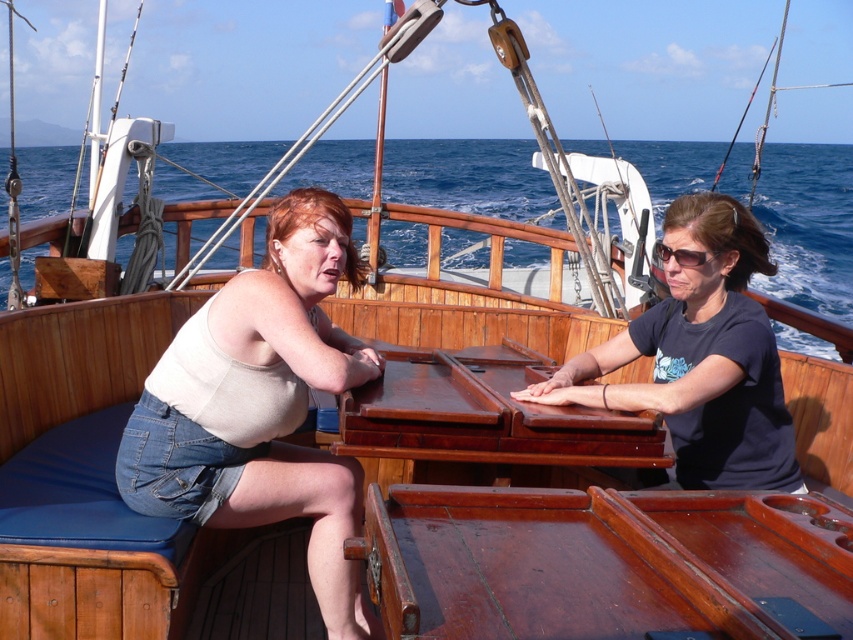
Question: Which point is farther to the camera?

Choices:
 (A) matte beige tank top at left
 (B) blue water at center

Answer: (B)

Question: Can you confirm if matte beige tank top at left is positioned to the left of blue water at center?

Choices:
 (A) yes
 (B) no

Answer: (B)

Question: Considering the real-world distances, which object is closest to the blue water at center?

Choices:
 (A) matte beige tank top at left
 (B) black plastic sunglasses at upper right

Answer: (A)

Question: Which object is closer to the camera taking this photo?

Choices:
 (A) blue water at center
 (B) black plastic sunglasses at upper right
 (C) matte beige tank top at left

Answer: (C)

Question: Is blue water at center to the right of black plastic sunglasses at upper right from the viewer's perspective?

Choices:
 (A) no
 (B) yes

Answer: (A)

Question: Is blue water at center positioned behind black plastic sunglasses at upper right?

Choices:
 (A) no
 (B) yes

Answer: (B)